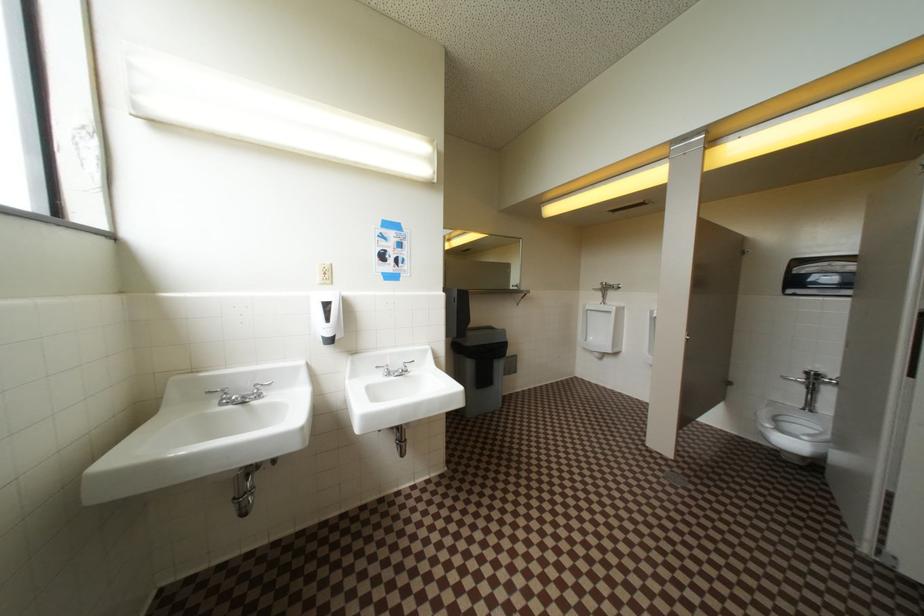
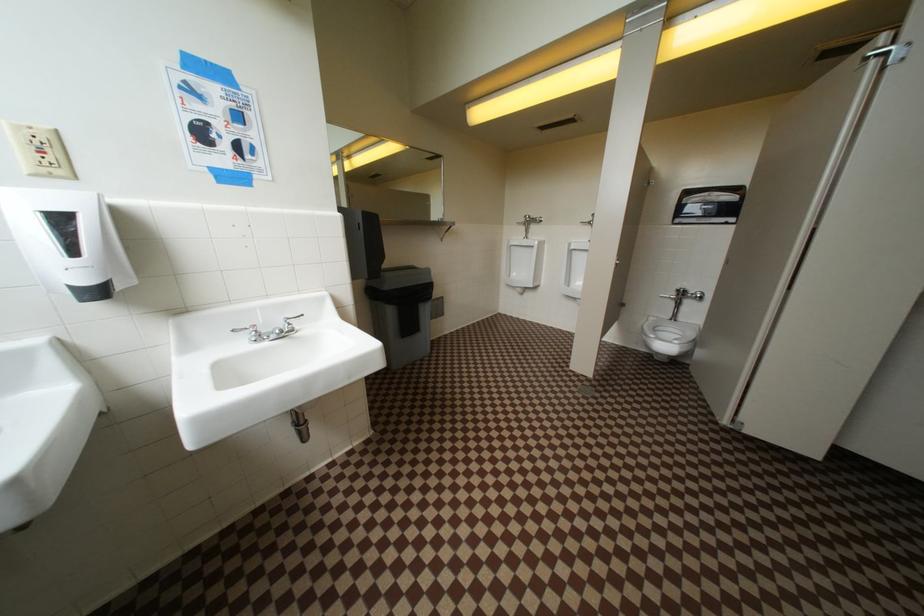
Question: The images are taken continuously from a first-person perspective. In which direction is your viewpoint rotating?

Choices:
 (A) Left
 (B) Right
 (C) Up
 (D) Down

Answer: (B)